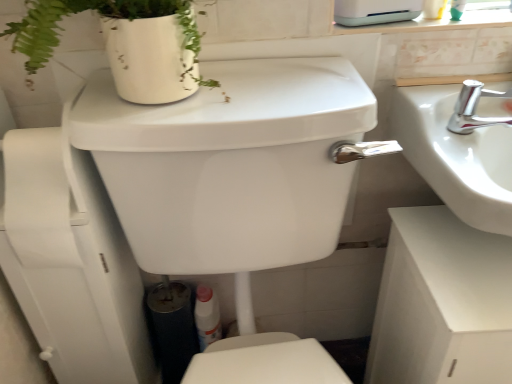
The image size is (512, 384). What are the coordinates of `vacant area situated below white glossy sink at right (from a real-world perspective)` in the screenshot? It's located at (470, 255).